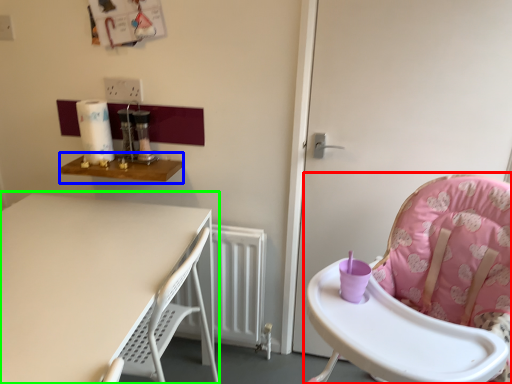
Question: Which object is the closest to the chair (highlighted by a red box)? Choose among these: table (highlighted by a blue box) or table (highlighted by a green box).

Choices:
 (A) table
 (B) table

Answer: (B)